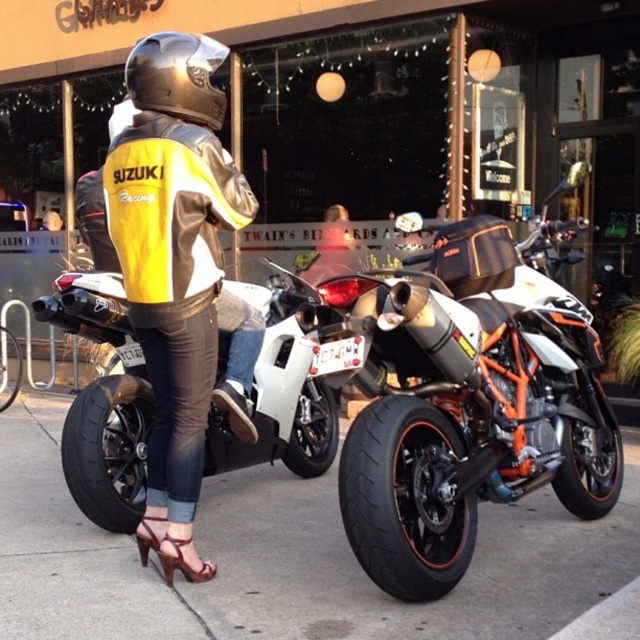
Can you confirm if black asphalt pavement at lower center is wider than shiny metallic helmet at center?

Indeed, black asphalt pavement at lower center has a greater width compared to shiny metallic helmet at center.

Who is positioned more to the left, black asphalt pavement at lower center or shiny metallic helmet at center?

From the viewer's perspective, shiny metallic helmet at center appears more on the left side.

Is point (92, 572) positioned before point (170, 32)?

Yes.

You are a GUI agent. You are given a task and a screenshot of the screen. Output one action in this format:
    pyautogui.click(x=<x>, y=<y>)
    Task: Click on the black asphalt pavement at lower center
    
    Given the screenshot: What is the action you would take?
    pyautogui.click(x=292, y=561)

Is black asphalt pavement at lower center positioned before white matte sportbike at center?

Yes, black asphalt pavement at lower center is closer to the viewer.

Measure the distance between black asphalt pavement at lower center and camera.

The distance of black asphalt pavement at lower center from camera is 8.90 feet.

The height and width of the screenshot is (640, 640). What are the coordinates of `black asphalt pavement at lower center` in the screenshot? It's located at (292, 561).

Where is `black asphalt pavement at lower center`? Image resolution: width=640 pixels, height=640 pixels. black asphalt pavement at lower center is located at coordinates (292, 561).

Does black asphalt pavement at lower center appear under yellow/black leather jacket at center?

Correct, black asphalt pavement at lower center is located below yellow/black leather jacket at center.

Does point (616, 564) come behind point (141, 122)?

Yes.

Is point (301, 508) positioned before point (252, 205)?

That is False.

This screenshot has width=640, height=640. I want to click on black asphalt pavement at lower center, so click(292, 561).